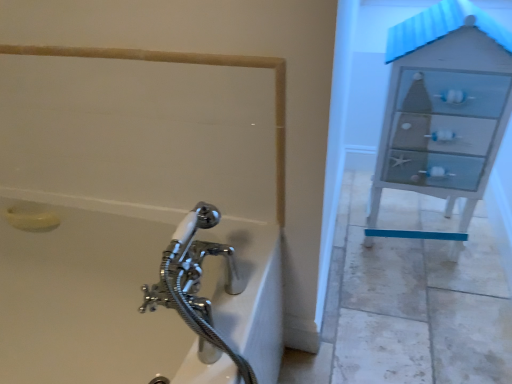
Question: Can you confirm if yellow matte soap at lower left is wider than white glossy bathtub at lower left?

Choices:
 (A) yes
 (B) no

Answer: (B)

Question: From a real-world perspective, does yellow matte soap at lower left stand above white glossy bathtub at lower left?

Choices:
 (A) no
 (B) yes

Answer: (B)

Question: Is yellow matte soap at lower left in contact with white glossy bathtub at lower left?

Choices:
 (A) no
 (B) yes

Answer: (A)

Question: From the image's perspective, does yellow matte soap at lower left appear lower than white glossy bathtub at lower left?

Choices:
 (A) no
 (B) yes

Answer: (A)

Question: Is yellow matte soap at lower left to the left of white glossy bathtub at lower left from the viewer's perspective?

Choices:
 (A) yes
 (B) no

Answer: (A)

Question: Looking at the image, does white glossy file cabinet at right seem bigger or smaller compared to white glossy bathtub at lower left?

Choices:
 (A) big
 (B) small

Answer: (B)

Question: Would you say white glossy file cabinet at right is to the left or to the right of white glossy bathtub at lower left in the picture?

Choices:
 (A) right
 (B) left

Answer: (A)

Question: From a real-world perspective, is white glossy file cabinet at right physically located above or below white glossy bathtub at lower left?

Choices:
 (A) above
 (B) below

Answer: (A)

Question: Is white glossy file cabinet at right taller or shorter than white glossy bathtub at lower left?

Choices:
 (A) tall
 (B) short

Answer: (A)

Question: Is beige matte rail at upper left taller or shorter than yellow matte soap at lower left?

Choices:
 (A) tall
 (B) short

Answer: (B)

Question: In the image, is beige matte rail at upper left on the left side or the right side of yellow matte soap at lower left?

Choices:
 (A) right
 (B) left

Answer: (A)

Question: Considering the positions of point (130, 57) and point (42, 216), is point (130, 57) closer or farther from the camera than point (42, 216)?

Choices:
 (A) closer
 (B) farther

Answer: (A)

Question: Which is correct: beige matte rail at upper left is inside yellow matte soap at lower left, or outside of it?

Choices:
 (A) inside
 (B) outside

Answer: (B)

Question: In the image, is beige matte rail at upper left positioned in front of or behind white glossy bathtub at lower left?

Choices:
 (A) behind
 (B) front

Answer: (A)

Question: Choose the correct answer: Is beige matte rail at upper left inside white glossy bathtub at lower left or outside it?

Choices:
 (A) inside
 (B) outside

Answer: (B)